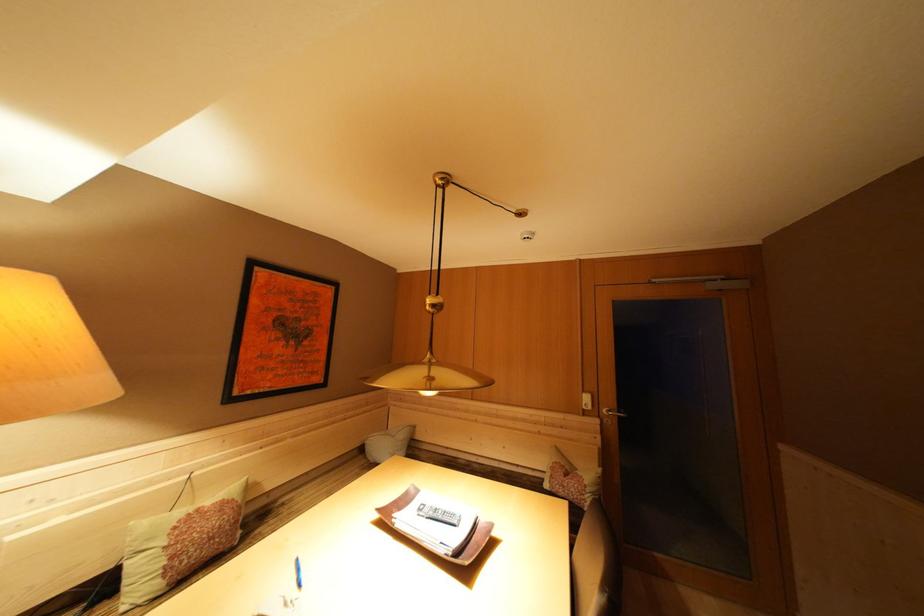
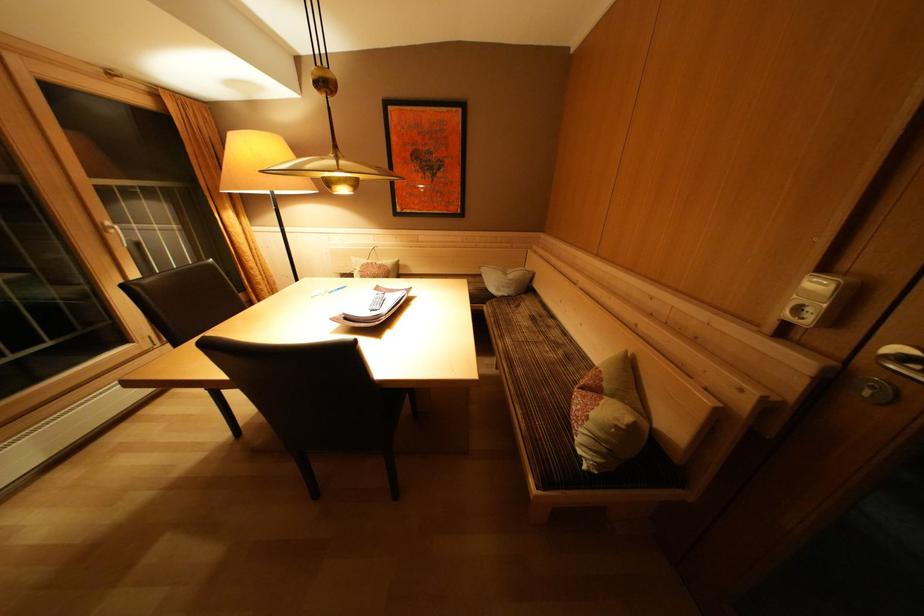
In the second image, find the point that corresponds to the point at 408,440 in the first image.

(517, 281)